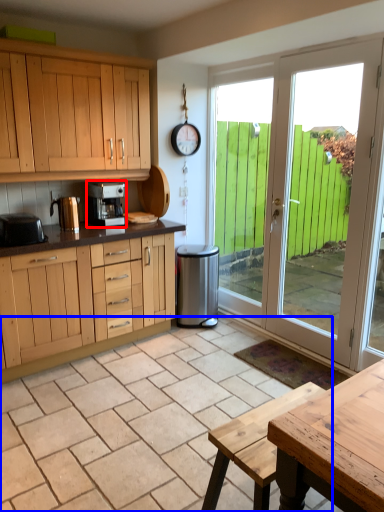
Question: Which object appears closest to the camera in this image, kitchen appliance (highlighted by a red box) or tile (highlighted by a blue box)?

Choices:
 (A) kitchen appliance
 (B) tile

Answer: (B)